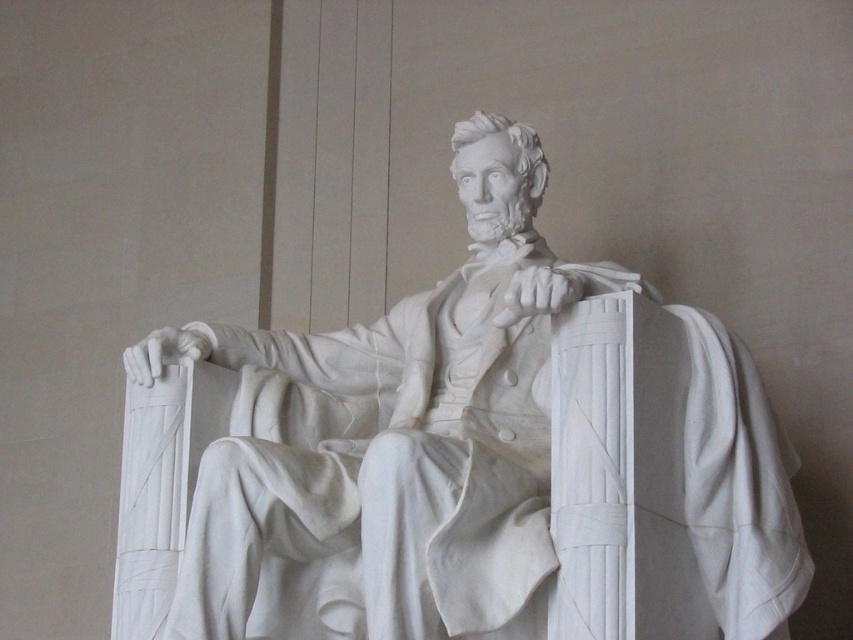
Is white marble statue at center to the left of white marble book at center from the viewer's perspective?

Correct, you'll find white marble statue at center to the left of white marble book at center.

Consider the image. Which is below, white marble statue at center or white marble book at center?

white marble book at center is below.

Describe the element at coordinates (392, 442) in the screenshot. I see `white marble statue at center` at that location.

Locate an element on the screen. This screenshot has width=853, height=640. white marble statue at center is located at coordinates (392, 442).